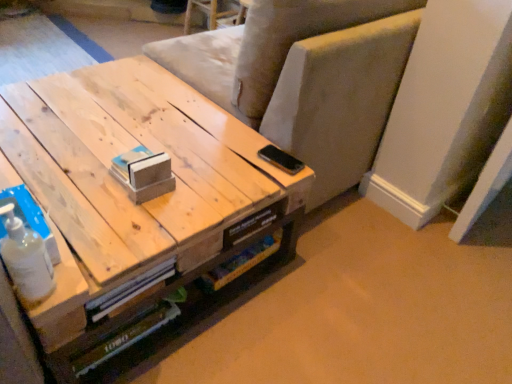
At what (x,y) coordinates should I click in order to perform the action: click on vacant point to the right of white matte bottle at lower left. Please return your answer as a coordinate pair (x, y). Looking at the image, I should click on (100, 263).